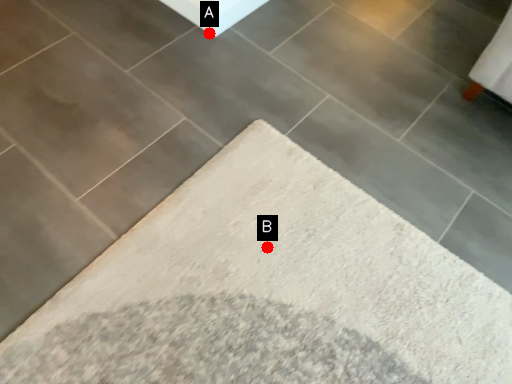
Question: Two points are circled on the image, labeled by A and B beside each circle. Which point is further to the camera?

Choices:
 (A) A is further
 (B) B is further

Answer: (A)